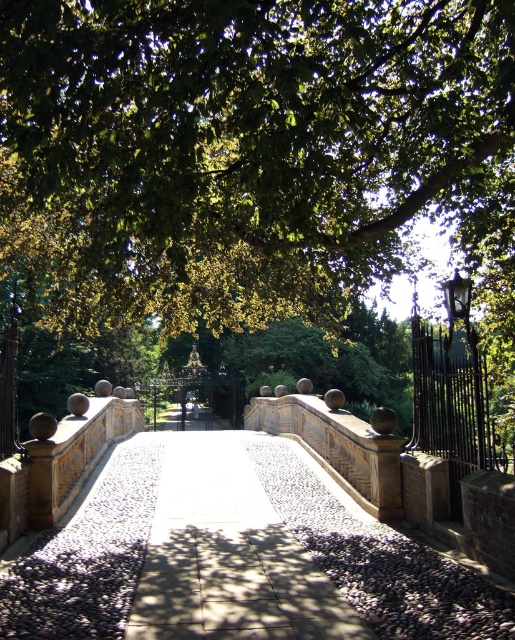
Question: Can you confirm if green leafy tree at upper center is positioned to the left of white stone path at center?

Choices:
 (A) no
 (B) yes

Answer: (A)

Question: Among these objects, which one is nearest to the camera?

Choices:
 (A) green leafy tree at upper center
 (B) white stone path at center

Answer: (A)

Question: Does white stone path at center have a smaller size compared to black wrought iron fence at right?

Choices:
 (A) no
 (B) yes

Answer: (B)

Question: Which object is closer to the camera taking this photo?

Choices:
 (A) white stone path at center
 (B) green leafy tree at upper center

Answer: (B)

Question: Is the position of white stone path at center less distant than that of black wrought iron fence at right?

Choices:
 (A) yes
 (B) no

Answer: (A)

Question: Estimate the real-world distances between objects in this image. Which object is closer to the white stone path at center?

Choices:
 (A) green leafy tree at upper center
 (B) black wrought iron fence at right

Answer: (B)